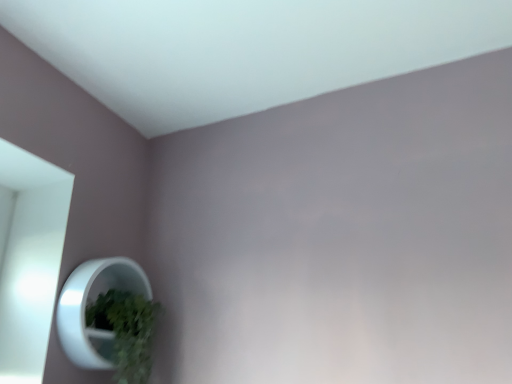
Question: Is white glossy mirror at lower left located outside green matte plant at lower left?

Choices:
 (A) no
 (B) yes

Answer: (A)

Question: Is white glossy mirror at lower left next to green matte plant at lower left and touching it?

Choices:
 (A) yes
 (B) no

Answer: (A)

Question: Is white glossy mirror at lower left closer to the viewer compared to green matte plant at lower left?

Choices:
 (A) no
 (B) yes

Answer: (B)

Question: Is white glossy mirror at lower left facing away from green matte plant at lower left?

Choices:
 (A) yes
 (B) no

Answer: (A)

Question: Is white glossy mirror at lower left wider than green matte plant at lower left?

Choices:
 (A) no
 (B) yes

Answer: (A)

Question: Is white glossy mirror at lower left to the right of green matte plant at lower left from the viewer's perspective?

Choices:
 (A) yes
 (B) no

Answer: (B)

Question: Considering the relative sizes of green matte plant at lower left and white glossy mirror at lower left in the image provided, is green matte plant at lower left taller than white glossy mirror at lower left?

Choices:
 (A) no
 (B) yes

Answer: (A)

Question: Does green matte plant at lower left have a greater width compared to white glossy mirror at lower left?

Choices:
 (A) yes
 (B) no

Answer: (A)

Question: Considering the relative sizes of green matte plant at lower left and white glossy mirror at lower left in the image provided, is green matte plant at lower left shorter than white glossy mirror at lower left?

Choices:
 (A) yes
 (B) no

Answer: (A)

Question: Is green matte plant at lower left positioned in front of white glossy mirror at lower left?

Choices:
 (A) yes
 (B) no

Answer: (B)

Question: Considering the relative positions of green matte plant at lower left and white glossy mirror at lower left in the image provided, is green matte plant at lower left to the right of white glossy mirror at lower left from the viewer's perspective?

Choices:
 (A) no
 (B) yes

Answer: (B)

Question: Could you tell me if green matte plant at lower left is turned towards white glossy mirror at lower left?

Choices:
 (A) no
 (B) yes

Answer: (B)

Question: From a real-world perspective, is green matte plant at lower left positioned above or below white glossy mirror at lower left?

Choices:
 (A) above
 (B) below

Answer: (B)